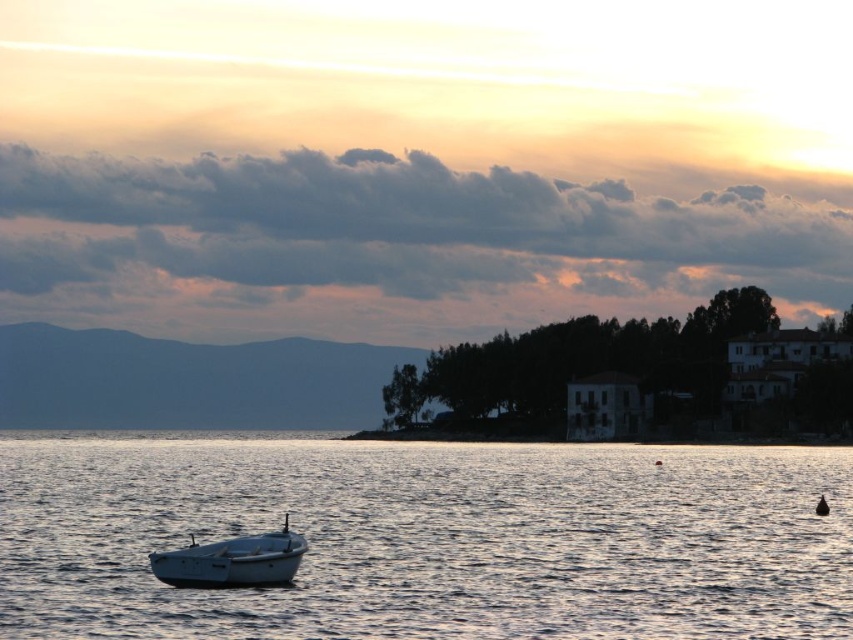
Question: In this image, where is silvery water at boat left located relative to white matte boat at lower left?

Choices:
 (A) right
 (B) left

Answer: (A)

Question: Which of the following is the farthest from the observer?

Choices:
 (A) silvery water at boat left
 (B) white matte boat at lower left

Answer: (B)

Question: Among these points, which one is nearest to the camera?

Choices:
 (A) (252, 557)
 (B) (668, 461)

Answer: (A)

Question: Can you confirm if silvery water at boat left is positioned to the left of white matte boat at lower left?

Choices:
 (A) yes
 (B) no

Answer: (B)

Question: Can you confirm if silvery water at boat left is positioned to the right of white matte boat at lower left?

Choices:
 (A) yes
 (B) no

Answer: (A)